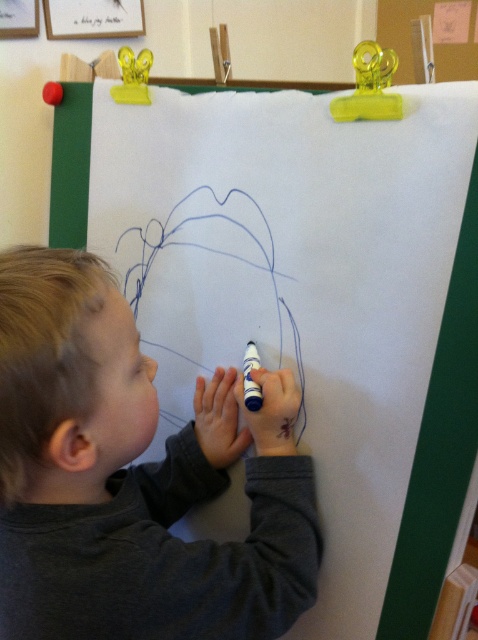
Question: Can you confirm if dark gray sweater at lower left is positioned to the left of blue matte marker at lower center?

Choices:
 (A) no
 (B) yes

Answer: (B)

Question: From the image, what is the correct spatial relationship of dark gray sweater at lower left in relation to blue matte marker at lower center?

Choices:
 (A) left
 (B) right

Answer: (A)

Question: Which of the following is the closest to the observer?

Choices:
 (A) blue matte marker at lower center
 (B) dark gray sweater at lower left

Answer: (B)

Question: Which point is closer to the camera taking this photo?

Choices:
 (A) (28, 320)
 (B) (248, 342)

Answer: (A)

Question: Does dark gray sweater at lower left appear on the left side of blue matte marker at lower center?

Choices:
 (A) yes
 (B) no

Answer: (A)